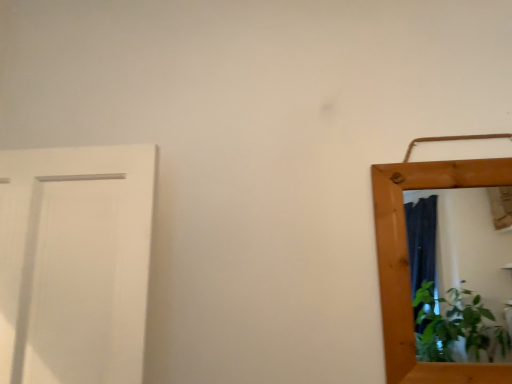
The image size is (512, 384). Describe the element at coordinates (457, 275) in the screenshot. I see `wooden mirror at right` at that location.

Find the location of a particular element. wooden mirror at right is located at coordinates (457, 275).

Find the location of `wooden mirror at right`. wooden mirror at right is located at coordinates (457, 275).